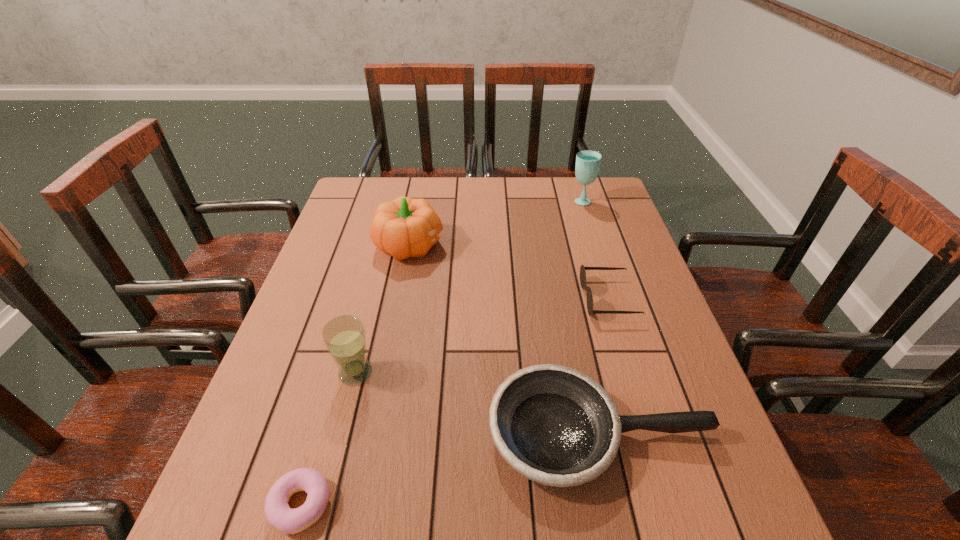
Locate an element on the screen. free space between the pumpkin and the farther glass is located at coordinates (495, 222).

The width and height of the screenshot is (960, 540). In order to click on free space between the taller glass and the pumpkin in this screenshot , I will do `click(495, 222)`.

Where is `vacant area that lies between the pumpkin and the nearer glass`? vacant area that lies between the pumpkin and the nearer glass is located at coordinates 383,308.

Identify the location of free point between the frying pan and the left glass. This screenshot has width=960, height=540. (478, 402).

At what (x,y) coordinates should I click in order to perform the action: click on vacant space that is in between the shortest object and the frying pan. Please return your answer as a coordinate pair (x, y). This screenshot has width=960, height=540. Looking at the image, I should click on (451, 469).

This screenshot has height=540, width=960. Find the location of `free space between the farthest object and the fourth nearest object`. free space between the farthest object and the fourth nearest object is located at coordinates (594, 249).

The width and height of the screenshot is (960, 540). What are the coordinates of `free space between the right glass and the frying pan` in the screenshot? It's located at (591, 316).

Identify the location of vacant area between the pumpkin and the farther glass. The width and height of the screenshot is (960, 540). (495, 222).

Identify the location of free spot between the farthest object and the frying pan. Image resolution: width=960 pixels, height=540 pixels. (591, 316).

You are a GUI agent. You are given a task and a screenshot of the screen. Output one action in this format:
    pyautogui.click(x=<x>, y=<y>)
    Task: Click on the free spot between the fifth nearest object and the frying pan
    
    Given the screenshot: What is the action you would take?
    pyautogui.click(x=505, y=339)